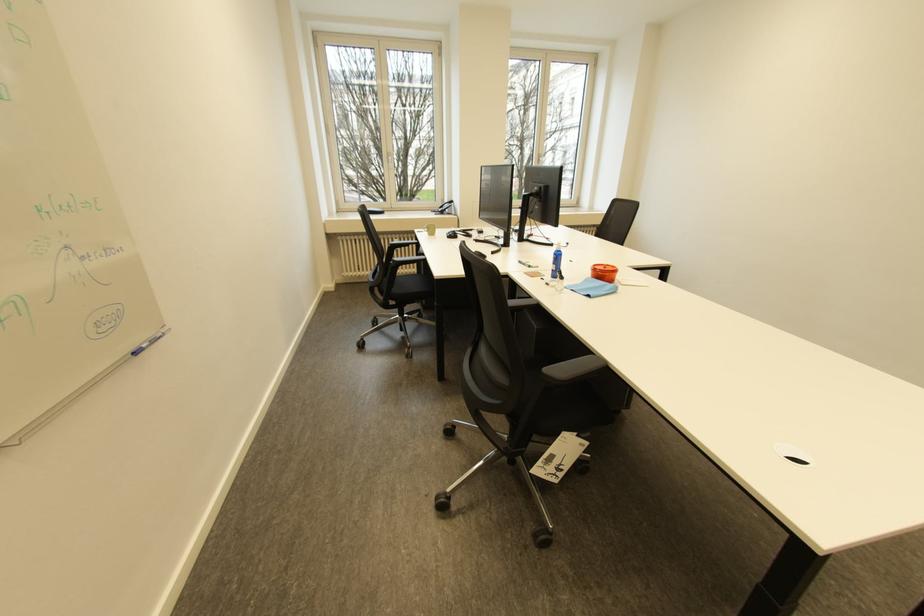
This screenshot has height=616, width=924. In order to click on chair sitting surface in this screenshot , I will do `click(407, 284)`.